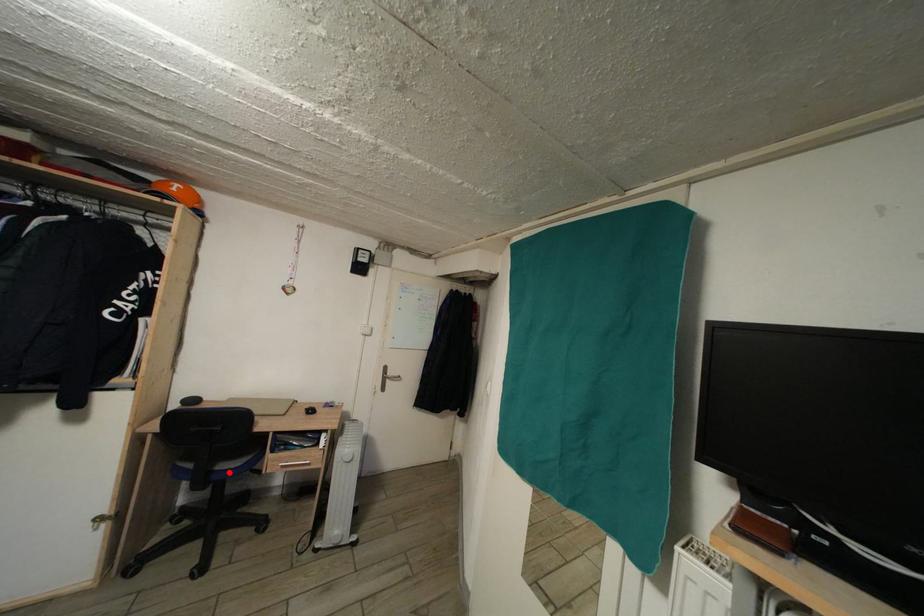
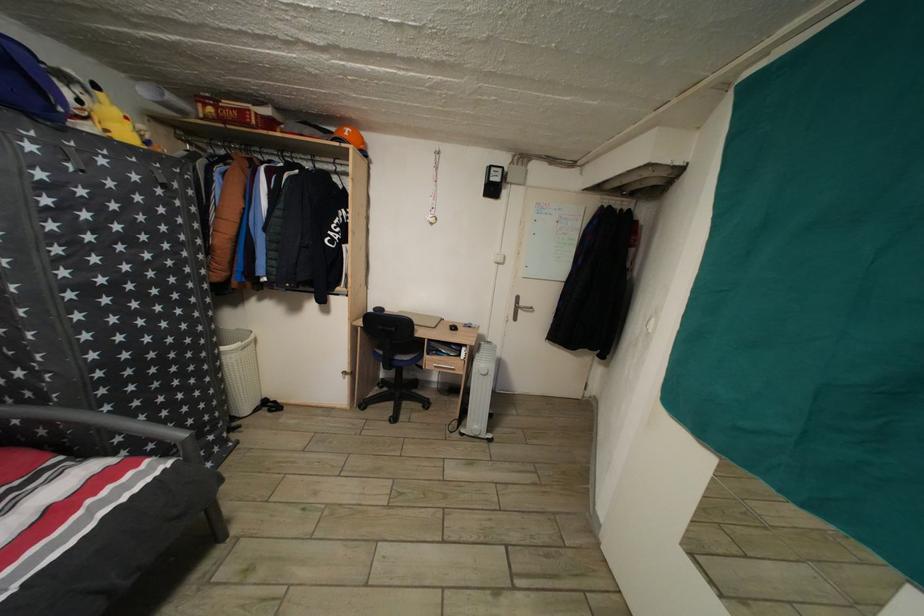
Question: I am providing you with two images of the same scene from different viewpoints. Given a red point in image1, look at the same physical point in image2. Is it:

Choices:
 (A) Closer to the viewpoint
 (B) Farther from the viewpoint

Answer: (B)